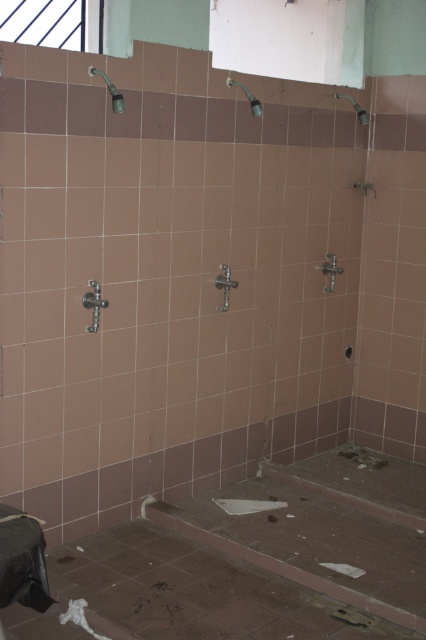
Consider the image. You are a maintenance worker checking the shower facilities. You need to know which object is narrower between the metallic silver faucet at center and the matte silver shower head at upper right. Can you tell me?

The metallic silver faucet at center has a lesser width compared to the matte silver shower head at upper right, so the metallic silver faucet at center is narrower.

You are a maintenance worker needing to replace a part between the metallic silver faucet at upper center and the matte silver shower head at upper right. The replacement part requires a minimum of 30 inches of space between them. Is the available space sufficient?

The metallic silver faucet at upper center and matte silver shower head at upper right are 32.30 inches apart, which is more than the required 30 inches. Therefore, the available space is sufficient for the replacement part.

You are a maintenance worker assessing the shower heads in the public shower area. You need to determine which shower head has a larger width. Which one is wider between the matte silver shower head at upper left and the matte silver shower head at upper right?

The matte silver shower head at upper right is wider than the matte silver shower head at upper left according to the description.